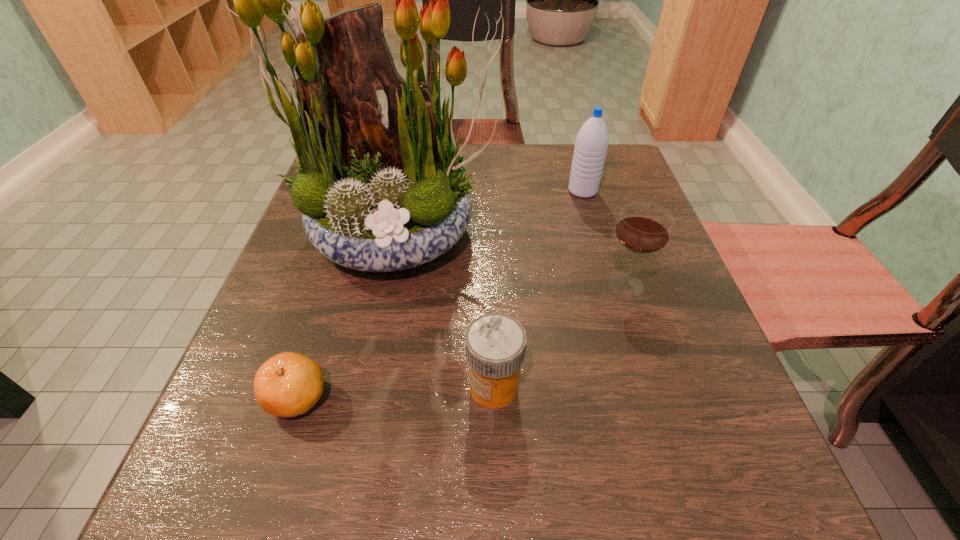
This screenshot has height=540, width=960. I want to click on free location at the far edge, so click(x=467, y=154).

The width and height of the screenshot is (960, 540). In the image, there is a desktop. Find the location of `free region at the near edge`. free region at the near edge is located at coordinates (530, 502).

Find the location of a particular element. The height and width of the screenshot is (540, 960). blank space at the left edge of the desktop is located at coordinates (249, 451).

What are the coordinates of `free space at the right edge` in the screenshot? It's located at (660, 348).

Where is `blank space at the near left corner of the desktop`? This screenshot has height=540, width=960. blank space at the near left corner of the desktop is located at coordinates (249, 500).

At what (x,y) coordinates should I click in order to perform the action: click on vacant region at the far right corner of the desktop. Please return your answer as a coordinate pair (x, y). The image size is (960, 540). Looking at the image, I should click on (630, 160).

Locate an element on the screen. The height and width of the screenshot is (540, 960). unoccupied area between the clementine and the third tallest object is located at coordinates (462, 341).

Where is `vacant space that is in between the flower arrangement and the shortest object`? Image resolution: width=960 pixels, height=540 pixels. vacant space that is in between the flower arrangement and the shortest object is located at coordinates (348, 315).

At what (x,y) coordinates should I click in order to perform the action: click on free space between the fourth tallest object and the third shortest object. Please return your answer as a coordinate pair (x, y). Image resolution: width=960 pixels, height=540 pixels. Looking at the image, I should click on (560, 336).

This screenshot has width=960, height=540. What are the coordinates of `vacant area between the clementine and the third shortest object` in the screenshot? It's located at (462, 341).